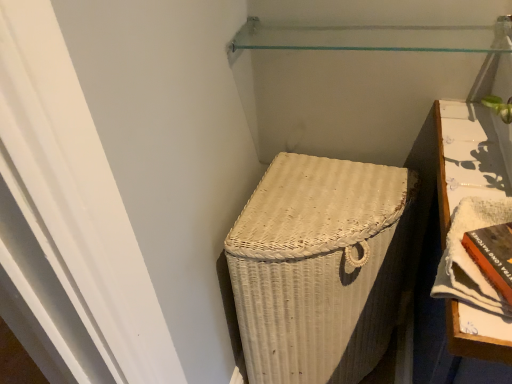
Question: Does transparent glass shelf at upper center have a lesser width compared to orange hardcover book at right, marked as the second book in a left-to-right arrangement?

Choices:
 (A) yes
 (B) no

Answer: (A)

Question: Is transparent glass shelf at upper center to the left of orange hardcover book at right, positioned as the 1th book in right-to-left order, from the viewer's perspective?

Choices:
 (A) no
 (B) yes

Answer: (B)

Question: Is transparent glass shelf at upper center outside orange hardcover book at right, positioned as the 1th book in right-to-left order?

Choices:
 (A) yes
 (B) no

Answer: (A)

Question: Can you confirm if transparent glass shelf at upper center is smaller than orange hardcover book at right, positioned as the 1th book in right-to-left order?

Choices:
 (A) no
 (B) yes

Answer: (B)

Question: Does transparent glass shelf at upper center appear on the right side of orange hardcover book at right, positioned as the 1th book in right-to-left order?

Choices:
 (A) no
 (B) yes

Answer: (A)

Question: From a real-world perspective, is transparent glass shelf at upper center positioned over orange hardcover book at right, marked as the second book in a left-to-right arrangement, based on gravity?

Choices:
 (A) yes
 (B) no

Answer: (A)

Question: Is orange hardcover book at lower right, which appears as the 1th book when viewed from the left, closer to camera compared to white wicker basket at lower right?

Choices:
 (A) no
 (B) yes

Answer: (B)

Question: Is orange hardcover book at lower right, the 2th book from the right, aimed at white wicker basket at lower right?

Choices:
 (A) yes
 (B) no

Answer: (B)

Question: Is orange hardcover book at lower right, the 2th book from the right, oriented away from white wicker basket at lower right?

Choices:
 (A) no
 (B) yes

Answer: (A)

Question: From the image's perspective, is orange hardcover book at lower right, which appears as the 1th book when viewed from the left, over white wicker basket at lower right?

Choices:
 (A) no
 (B) yes

Answer: (B)

Question: Does orange hardcover book at lower right, which appears as the 1th book when viewed from the left, have a greater height compared to white wicker basket at lower right?

Choices:
 (A) no
 (B) yes

Answer: (A)

Question: From a real-world perspective, does orange hardcover book at lower right, the 2th book from the right, stand above white wicker basket at lower right?

Choices:
 (A) yes
 (B) no

Answer: (A)

Question: Does orange hardcover book at right, positioned as the 1th book in right-to-left order, have a larger size compared to orange hardcover book at lower right, which appears as the 1th book when viewed from the left?

Choices:
 (A) no
 (B) yes

Answer: (B)